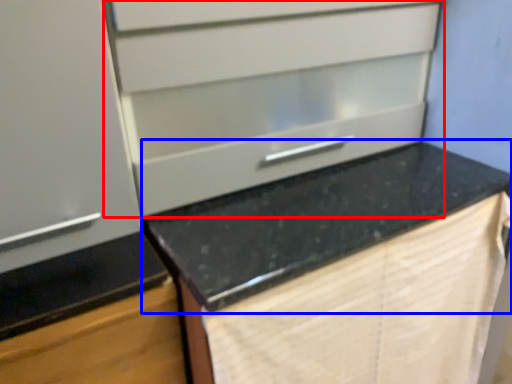
Question: Which point is further to the camera, drawer (highlighted by a red box) or countertop (highlighted by a blue box)?

Choices:
 (A) drawer
 (B) countertop

Answer: (A)